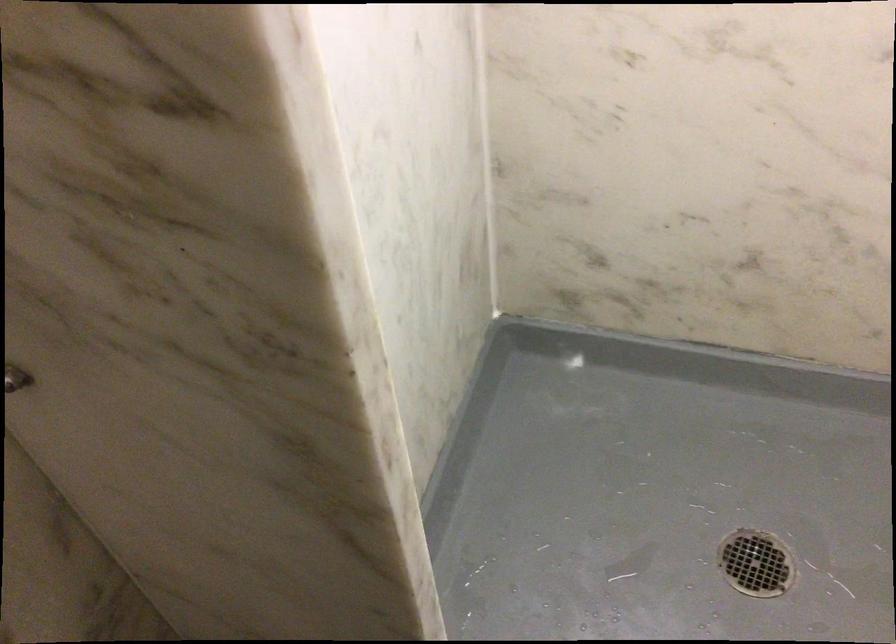
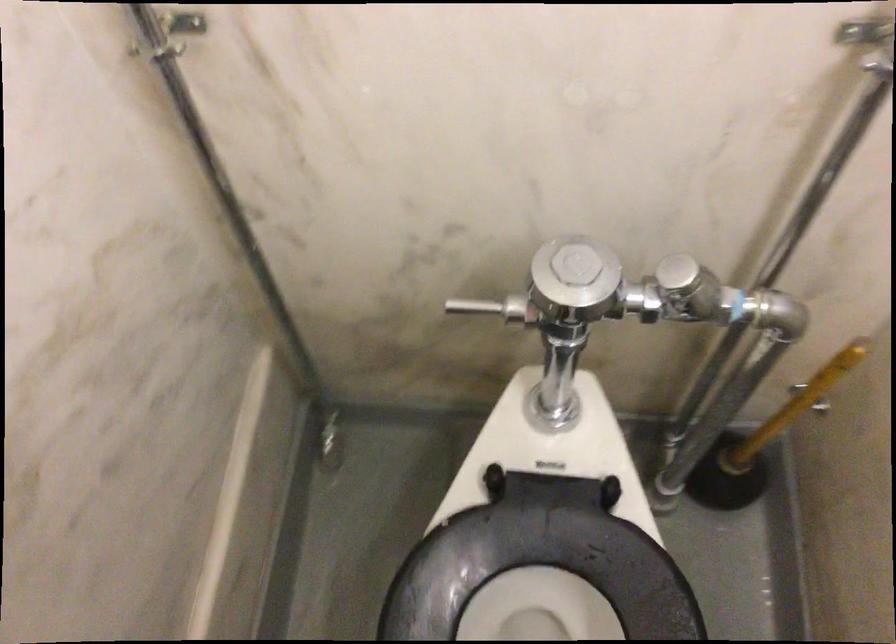
Question: Which direction would the cameraman need to move to produce the second image? Reply with the corresponding letter.

Choices:
 (A) Left
 (B) Right
 (C) Forward
 (D) Backward

Answer: (B)